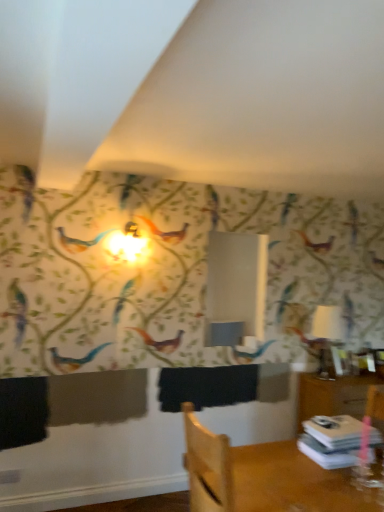
Question: Is white glossy table lamp at right oriented away from white paper stack at lower right?

Choices:
 (A) no
 (B) yes

Answer: (A)

Question: Is white glossy table lamp at right to the left of white paper stack at lower right from the viewer's perspective?

Choices:
 (A) yes
 (B) no

Answer: (B)

Question: From a real-world perspective, is white glossy table lamp at right physically above white paper stack at lower right?

Choices:
 (A) no
 (B) yes

Answer: (B)

Question: From a real-world perspective, is white glossy table lamp at right under white paper stack at lower right?

Choices:
 (A) yes
 (B) no

Answer: (B)

Question: From the image's perspective, is white glossy table lamp at right under white paper stack at lower right?

Choices:
 (A) yes
 (B) no

Answer: (B)

Question: From the image's perspective, relative to white glossy table lamp at right, is white paper stack at lower right above or below?

Choices:
 (A) above
 (B) below

Answer: (B)

Question: Is white paper stack at lower right situated inside white glossy table lamp at right or outside?

Choices:
 (A) inside
 (B) outside

Answer: (B)

Question: Is white paper stack at lower right bigger or smaller than white glossy table lamp at right?

Choices:
 (A) small
 (B) big

Answer: (A)

Question: Visually, is white paper stack at lower right positioned to the left or to the right of white glossy table lamp at right?

Choices:
 (A) left
 (B) right

Answer: (A)

Question: Looking at their shapes, would you say white paper stack at lower right is wider or thinner than wooden chair at lower right?

Choices:
 (A) wide
 (B) thin

Answer: (B)

Question: Does point (354, 417) appear closer or farther from the camera than point (339, 475)?

Choices:
 (A) farther
 (B) closer

Answer: (A)

Question: Would you say white paper stack at lower right is inside or outside wooden chair at lower right?

Choices:
 (A) inside
 (B) outside

Answer: (B)

Question: Based on their positions, is white paper stack at lower right located to the left or right of wooden chair at lower right?

Choices:
 (A) right
 (B) left

Answer: (A)

Question: Considering their positions, is wooden chair at lower right located in front of or behind white paper stack at lower right?

Choices:
 (A) front
 (B) behind

Answer: (A)

Question: From the image's perspective, is wooden chair at lower right positioned above or below white paper stack at lower right?

Choices:
 (A) above
 (B) below

Answer: (A)